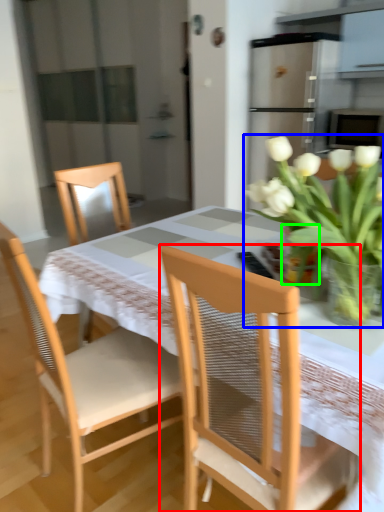
Question: Based on their relative distances, which object is nearer to chair (highlighted by a red box)? Choose from houseplant (highlighted by a blue box) and glass vase (highlighted by a green box).

Choices:
 (A) houseplant
 (B) glass vase

Answer: (A)